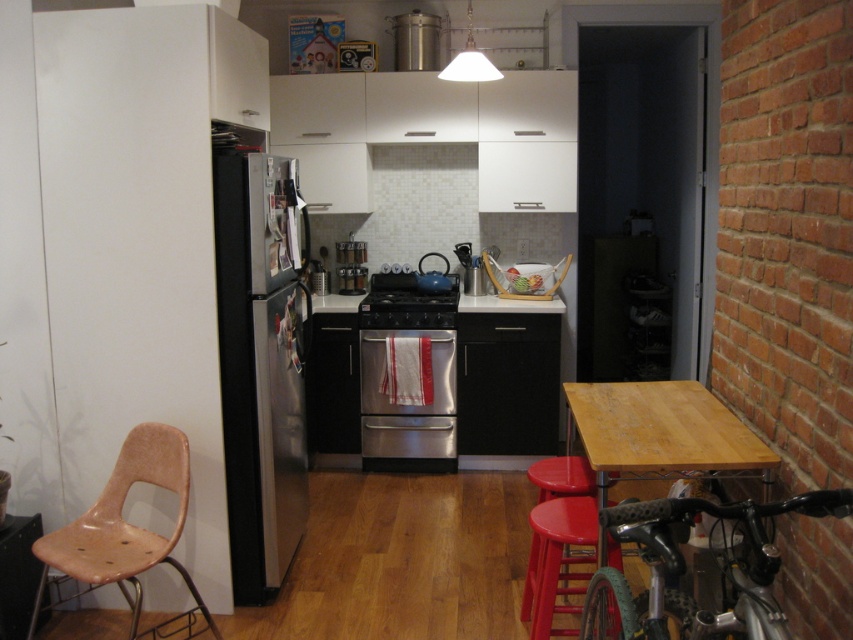
Consider the image. Who is taller, red plastic stool at lower right or teal matte kettle at center?

Standing taller between the two is red plastic stool at lower right.

Can you confirm if red plastic stool at lower right is shorter than teal matte kettle at center?

No, red plastic stool at lower right is not shorter than teal matte kettle at center.

This screenshot has height=640, width=853. Describe the element at coordinates (558, 563) in the screenshot. I see `red plastic stool at lower right` at that location.

Find the location of `red plastic stool at lower right`. red plastic stool at lower right is located at coordinates (558, 563).

Can you confirm if satin stainless steel refrigerator at left is thinner than stainless steel stove at center?

Yes.

Describe the element at coordinates (260, 360) in the screenshot. I see `satin stainless steel refrigerator at left` at that location.

The width and height of the screenshot is (853, 640). What are the coordinates of `satin stainless steel refrigerator at left` in the screenshot? It's located at (260, 360).

Can you confirm if satin stainless steel refrigerator at left is bigger than stainless steel oven at center?

Yes, satin stainless steel refrigerator at left is bigger than stainless steel oven at center.

Which is behind, point (241, 445) or point (437, 401)?

The point (437, 401) is more distant.

The image size is (853, 640). What are the coordinates of `satin stainless steel refrigerator at left` in the screenshot? It's located at coord(260,360).